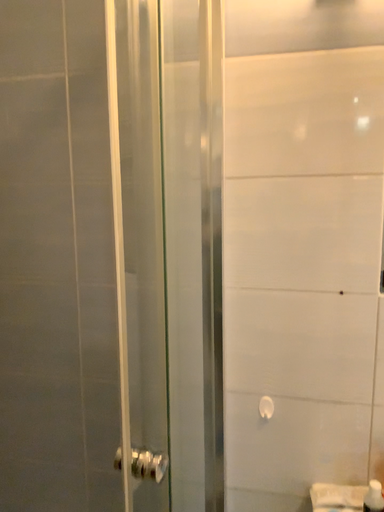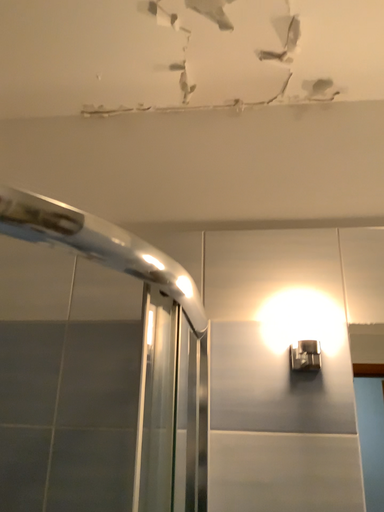
Question: How did the camera likely rotate when shooting the video?

Choices:
 (A) rotated left
 (B) rotated right

Answer: (B)